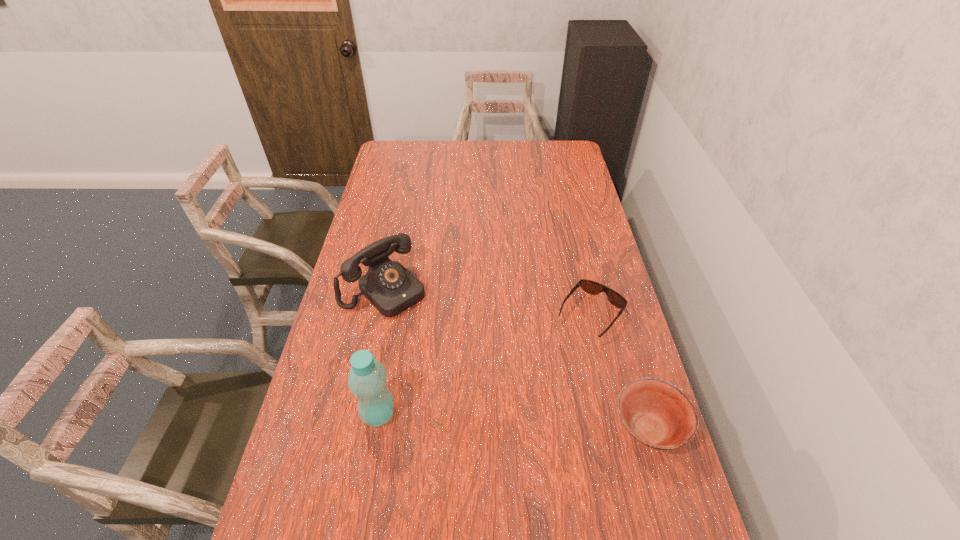
Where is `free space on the desktop that is between the bottle and the second shortest object and is positioned on the dial of the third shortest object`? free space on the desktop that is between the bottle and the second shortest object and is positioned on the dial of the third shortest object is located at coordinates (519, 422).

The width and height of the screenshot is (960, 540). I want to click on vacant spot on the desktop that is between the tallest object and the bowl and is positioned on the front-facing side of the shortest object, so click(x=509, y=422).